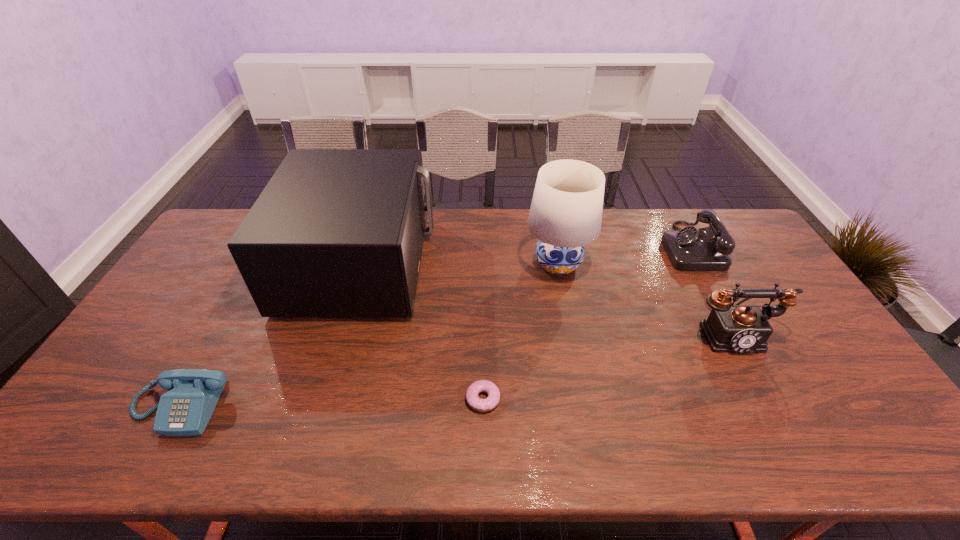
Locate an element on the screen. The height and width of the screenshot is (540, 960). empty space that is in between the second shortest telephone and the second nearest telephone is located at coordinates (711, 290).

Image resolution: width=960 pixels, height=540 pixels. Find the location of `vacant area that lies between the third object from left to right and the third object from right to left`. vacant area that lies between the third object from left to right and the third object from right to left is located at coordinates (520, 331).

Locate an element on the screen. vacant space that's between the shortest object and the farthest telephone is located at coordinates pos(586,322).

I want to click on free space between the third object from right to left and the shortest object, so click(520, 331).

This screenshot has height=540, width=960. I want to click on empty location between the second farthest telephone and the third shortest object, so click(711, 290).

Where is `vacant region between the second tallest telephone and the second nearest telephone`? vacant region between the second tallest telephone and the second nearest telephone is located at coordinates (711, 290).

I want to click on vacant point located between the fifth shortest object and the second tallest telephone, so click(x=525, y=255).

The width and height of the screenshot is (960, 540). In order to click on free space between the third object from right to left and the third shortest object in this screenshot , I will do `click(623, 255)`.

The image size is (960, 540). I want to click on object that is the second nearest to the microwave oven, so click(482, 405).

This screenshot has height=540, width=960. What are the coordinates of `object that is the second closest to the third tallest object` in the screenshot? It's located at (565, 215).